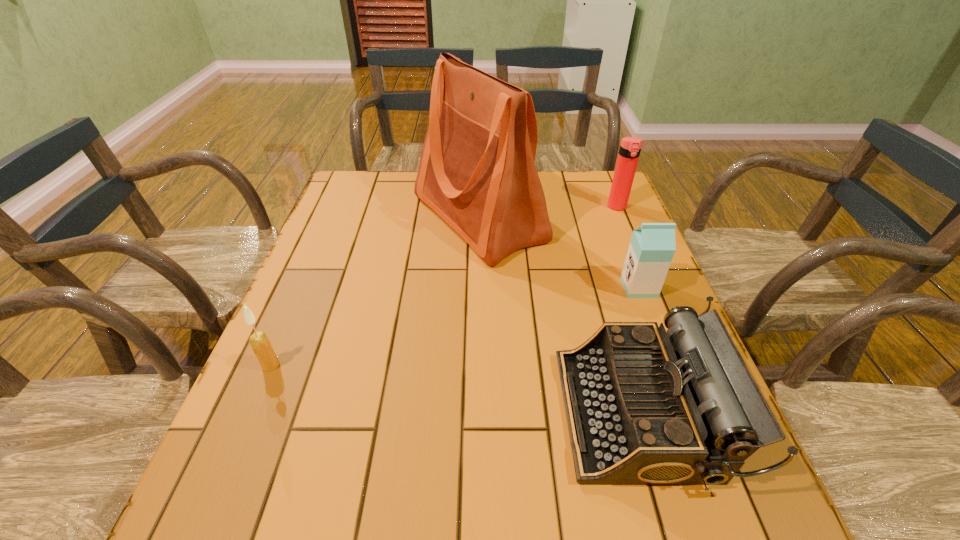
The image size is (960, 540). I want to click on free space between the tallest object and the milk carton, so click(559, 253).

Find the location of a particular element. vacant space in between the thermos bottle and the candle is located at coordinates (444, 286).

The height and width of the screenshot is (540, 960). I want to click on free space between the second tallest object and the milk carton, so click(x=628, y=247).

You are a GUI agent. You are given a task and a screenshot of the screen. Output one action in this format:
    pyautogui.click(x=<x>, y=<y>)
    Task: Click on the vacant space in between the third farthest object and the shopping bag
    
    Given the screenshot: What is the action you would take?
    pyautogui.click(x=559, y=253)

Select which object appears as the third closest to the third nearest object. Please provide its 2D coordinates. Your answer should be formatted as a tuple, i.e. [(x, y)], where the tuple contains the x and y coordinates of a point satisfying the conditions above.

[(630, 147)]

Identify which object is located as the third nearest to the thermos bottle. Please provide its 2D coordinates. Your answer should be formatted as a tuple, i.e. [(x, y)], where the tuple contains the x and y coordinates of a point satisfying the conditions above.

[(644, 406)]

Identify the location of free spot that satisfies the following two spatial constraints: 1. on the front side of the third nearest object; 2. on the keyboard of the typewriter. The image size is (960, 540). (687, 413).